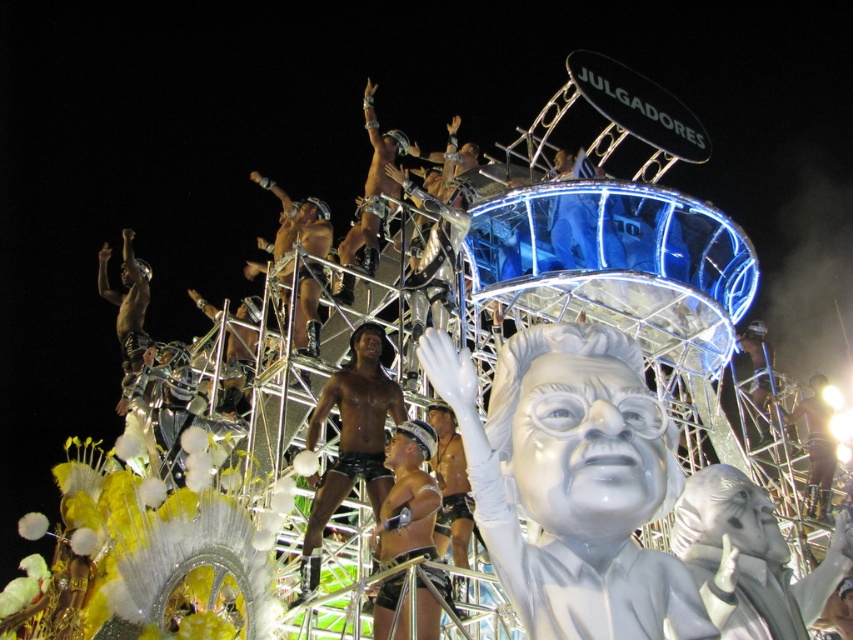
Question: Which of the following is the farthest from the observer?

Choices:
 (A) shiny silver shorts at center
 (B) white glossy statue at center

Answer: (A)

Question: Does white glossy statue at center have a lesser width compared to shiny silver shorts at center?

Choices:
 (A) no
 (B) yes

Answer: (A)

Question: In this image, where is white glossy statue at center located relative to shiny silver shorts at center?

Choices:
 (A) right
 (B) left

Answer: (A)

Question: Which point appears farthest from the camera in this image?

Choices:
 (A) coord(315,525)
 (B) coord(412,504)
 (C) coord(428,368)

Answer: (A)

Question: Which of these objects is positioned farthest from the shiny black shorts at center?

Choices:
 (A) shiny silver shorts at center
 (B) white glossy statue at center

Answer: (B)

Question: Can you confirm if shiny black shorts at center is thinner than shiny silver shorts at center?

Choices:
 (A) no
 (B) yes

Answer: (A)